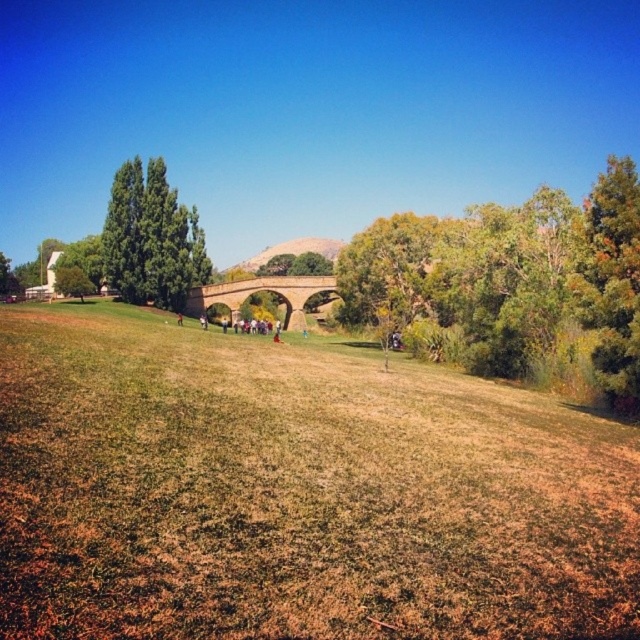
You are planning to set up a picnic area in this outdoor scene. You have a large picnic blanket that can cover an area as wide as the green grassy hillside at center. If you want to place the blanket under the green leafy tree at left, will it be wide enough to fully cover the area beneath the tree?

The green leafy tree at left has a lesser width compared to the green grassy hillside at center. Since the picnic blanket can cover an area as wide as the green grassy hillside at center, it will be wide enough to fully cover the area beneath the green leafy tree at left.

You are standing at the point marked by the coordinates [150,237] in the image. Looking around, you see a grassy field with a mix of green and brown patches and a stone bridge ahead. Which direction should you walk to reach the green leafy tree at left?

The point at coordinates [150,237] corresponds to the green leafy tree at left, so you are already at the tree. No need to move.